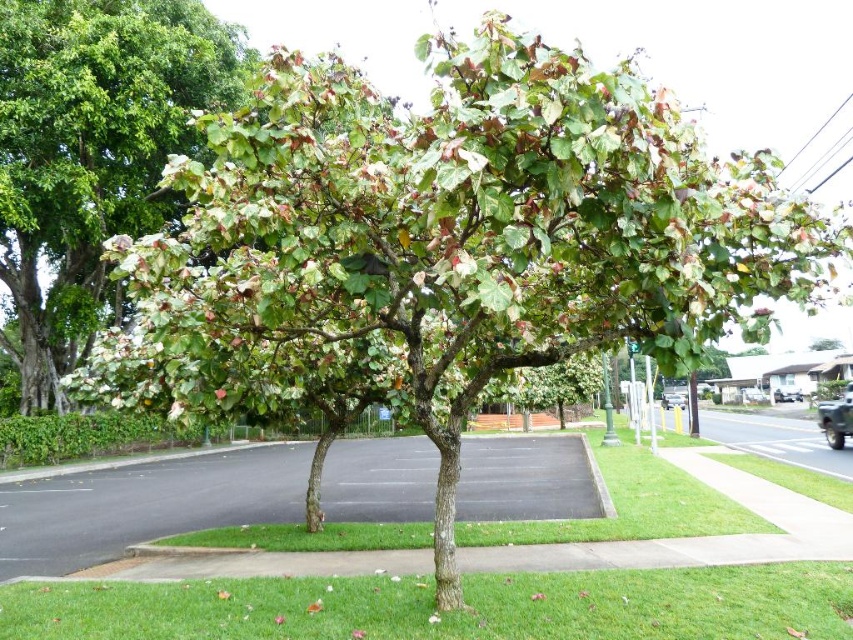
Question: Is the position of green leafy tree at center more distant than that of green grass at center?

Choices:
 (A) yes
 (B) no

Answer: (A)

Question: Which point is closer to the camera?

Choices:
 (A) green grass at center
 (B) green leafy tree at center

Answer: (A)

Question: Is green leafy tree at center above green grass at center?

Choices:
 (A) no
 (B) yes

Answer: (B)

Question: Does green leafy tree at center have a larger size compared to green grass at center?

Choices:
 (A) no
 (B) yes

Answer: (B)

Question: Which point is farther to the camera?

Choices:
 (A) green grass at center
 (B) green leafy tree at center

Answer: (B)